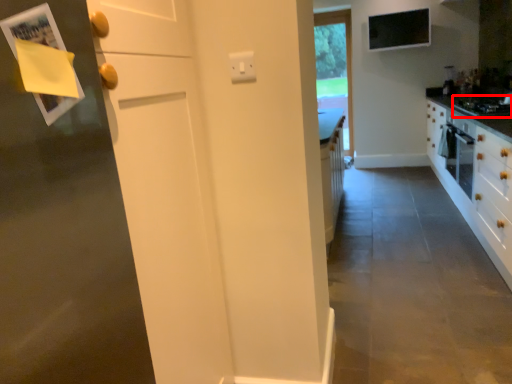
Question: In this image, where is gas stove (annotated by the red box) located relative to window?

Choices:
 (A) right
 (B) left

Answer: (A)